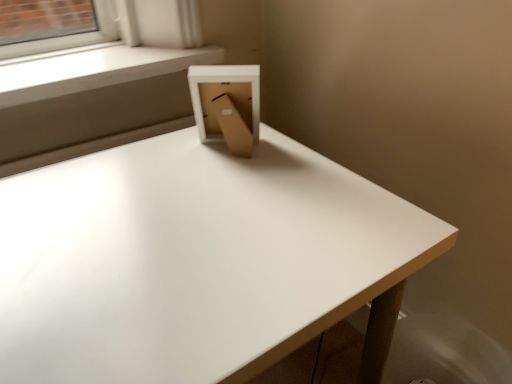
Question: Considering the relative sizes of white smooth window sill at upper left and white matte table at center in the image provided, is white smooth window sill at upper left smaller than white matte table at center?

Choices:
 (A) yes
 (B) no

Answer: (A)

Question: Is white smooth window sill at upper left further to the viewer compared to white matte table at center?

Choices:
 (A) no
 (B) yes

Answer: (B)

Question: From a real-world perspective, is white smooth window sill at upper left positioned over white matte table at center based on gravity?

Choices:
 (A) yes
 (B) no

Answer: (A)

Question: Is white smooth window sill at upper left far away from white matte table at center?

Choices:
 (A) yes
 (B) no

Answer: (B)

Question: From a real-world perspective, does white smooth window sill at upper left sit lower than white matte table at center?

Choices:
 (A) yes
 (B) no

Answer: (B)

Question: From the image's perspective, is white smooth window sill at upper left below white matte table at center?

Choices:
 (A) no
 (B) yes

Answer: (A)

Question: Is white matte table at center inside cardboard box at center?

Choices:
 (A) yes
 (B) no

Answer: (B)

Question: Can you confirm if cardboard box at center is thinner than white matte table at center?

Choices:
 (A) yes
 (B) no

Answer: (A)

Question: Does cardboard box at center have a greater width compared to white matte table at center?

Choices:
 (A) yes
 (B) no

Answer: (B)

Question: Is cardboard box at center oriented towards white matte table at center?

Choices:
 (A) yes
 (B) no

Answer: (B)

Question: Is cardboard box at center not close to white matte table at center?

Choices:
 (A) yes
 (B) no

Answer: (B)

Question: Is cardboard box at center closer to the viewer compared to white matte table at center?

Choices:
 (A) yes
 (B) no

Answer: (B)

Question: From the image's perspective, is cardboard box at center on top of white smooth window sill at upper left?

Choices:
 (A) no
 (B) yes

Answer: (A)